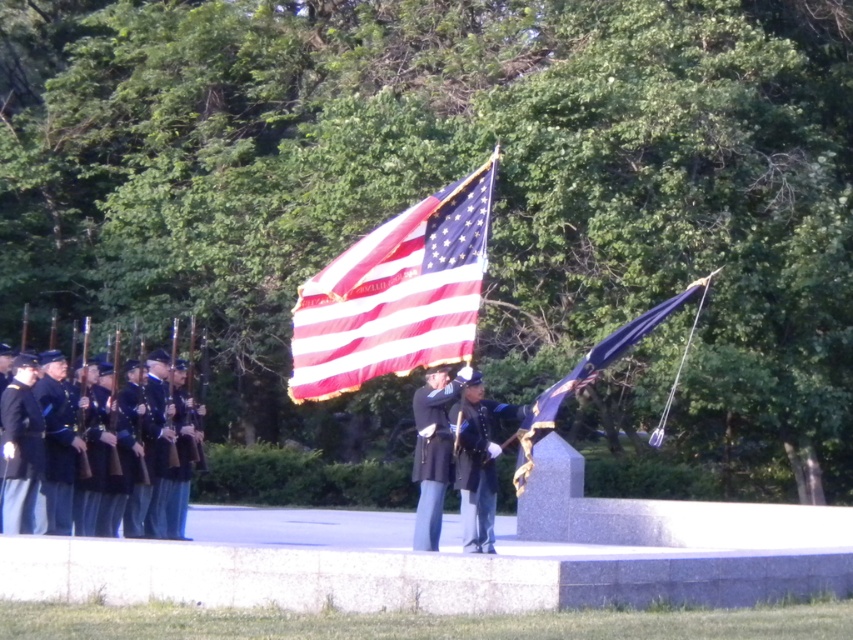
You are a photographer positioned at the back of the ceremony. You want to capture both the blue uniformed soldiers at left and the blue satin flag at center in a single shot. Which subject should you focus on first to ensure they are both in frame?

Since the blue uniformed soldiers at left are larger in size compared to the blue satin flag at center, you should focus on the blue uniformed soldiers at left first to ensure both are in frame.

You are a photographer positioned at the front row of the ceremony. You want to capture a closeup shot of the matte fabric flag at center and the dark blue wool jacket at center. Which object will appear larger in your photo?

The matte fabric flag at center will appear larger in the photo because it is closer to the viewer than the dark blue wool jacket at center.

You are a photographer positioned at the center of the ceremony area. You want to capture a photo of the matte fabric flag at center without including any of the uniformed individuals in the foreground. Is the flag positioned in a way that allows this?

The matte fabric flag at center is located at point (395, 294), which is centrally positioned. Since you are at the center of the ceremony area, you can aim your camera directly forward to capture the flag without including the uniformed individuals in the foreground who are positioned closer to the front.